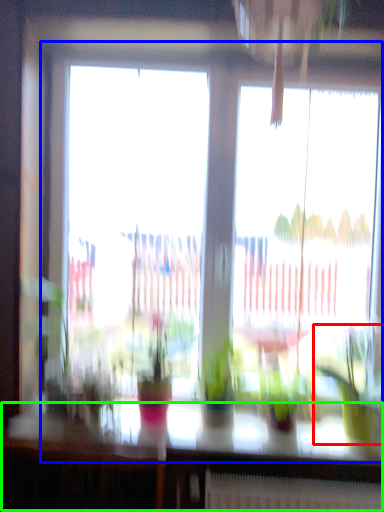
Question: Estimate the real-world distances between objects in this image. Which object is farther from houseplant (highlighted by a red box), window (highlighted by a blue box) or table (highlighted by a green box)?

Choices:
 (A) window
 (B) table

Answer: (A)